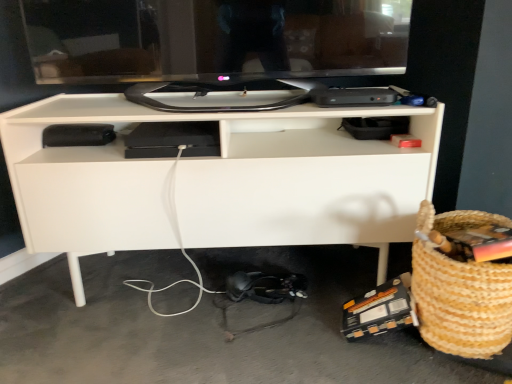
Question: From a real-world perspective, is black glossy monitor at upper center physically located above or below braided straw basket at lower right?

Choices:
 (A) below
 (B) above

Answer: (B)

Question: Considering their positions, is black glossy monitor at upper center located in front of or behind braided straw basket at lower right?

Choices:
 (A) front
 (B) behind

Answer: (B)

Question: Which is nearer to the black glossy monitor at upper center?

Choices:
 (A) braided straw basket at lower right
 (B) white matte desk at center

Answer: (B)

Question: Which object is positioned farthest from the braided straw basket at lower right?

Choices:
 (A) white matte desk at center
 (B) black glossy monitor at upper center

Answer: (B)